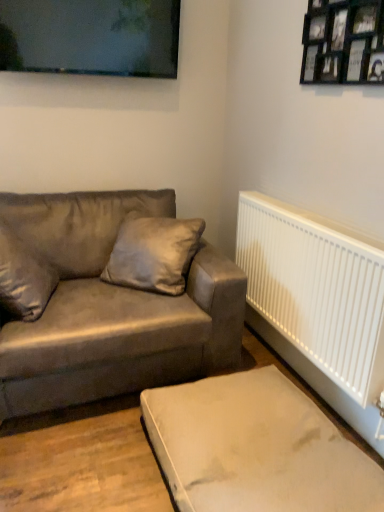
Question: From a real-world perspective, is black wooden picture frame at upper right, positioned as the 2th picture frame in back-to-front order, under suede-like brown couch at left?

Choices:
 (A) yes
 (B) no

Answer: (B)

Question: Is black wooden picture frame at upper right, positioned as the 2th picture frame in back-to-front order, positioned before suede-like brown couch at left?

Choices:
 (A) no
 (B) yes

Answer: (B)

Question: Is black wooden picture frame at upper right, which appears as the 1th picture frame when viewed from the front, shorter than suede-like brown couch at left?

Choices:
 (A) no
 (B) yes

Answer: (B)

Question: Is black wooden picture frame at upper right, positioned as the 2th picture frame in back-to-front order, in contact with suede-like brown couch at left?

Choices:
 (A) no
 (B) yes

Answer: (A)

Question: From the image's perspective, does black wooden picture frame at upper right, which ranks as the 1th picture frame in right-to-left order, appear higher than suede-like brown couch at left?

Choices:
 (A) no
 (B) yes

Answer: (B)

Question: Is black wooden picture frame at upper right, which appears as the 1th picture frame when viewed from the front, to the right of suede-like brown couch at left from the viewer's perspective?

Choices:
 (A) yes
 (B) no

Answer: (A)

Question: Considering the relative positions of matte black picture frame at upper center, the 1th picture frame when ordered from left to right, and beige fabric ottoman at lower right in the image provided, is matte black picture frame at upper center, the 1th picture frame when ordered from left to right, to the left of beige fabric ottoman at lower right from the viewer's perspective?

Choices:
 (A) no
 (B) yes

Answer: (B)

Question: From the image's perspective, is matte black picture frame at upper center, acting as the 1th picture frame starting from the back, located beneath beige fabric ottoman at lower right?

Choices:
 (A) no
 (B) yes

Answer: (A)

Question: Does matte black picture frame at upper center, which is the 2th picture frame in front-to-back order, have a smaller size compared to beige fabric ottoman at lower right?

Choices:
 (A) no
 (B) yes

Answer: (B)

Question: Can you confirm if matte black picture frame at upper center, acting as the 1th picture frame starting from the back, is thinner than beige fabric ottoman at lower right?

Choices:
 (A) no
 (B) yes

Answer: (B)

Question: Is matte black picture frame at upper center, the 1th picture frame when ordered from left to right, positioned before beige fabric ottoman at lower right?

Choices:
 (A) yes
 (B) no

Answer: (B)

Question: From the image's perspective, is matte black picture frame at upper center, the 1th picture frame when ordered from left to right, over beige fabric ottoman at lower right?

Choices:
 (A) yes
 (B) no

Answer: (A)

Question: Would you say suede-like beige pillow at center is a long distance from black wooden picture frame at upper right, which ranks as the 1th picture frame in right-to-left order?

Choices:
 (A) no
 (B) yes

Answer: (B)